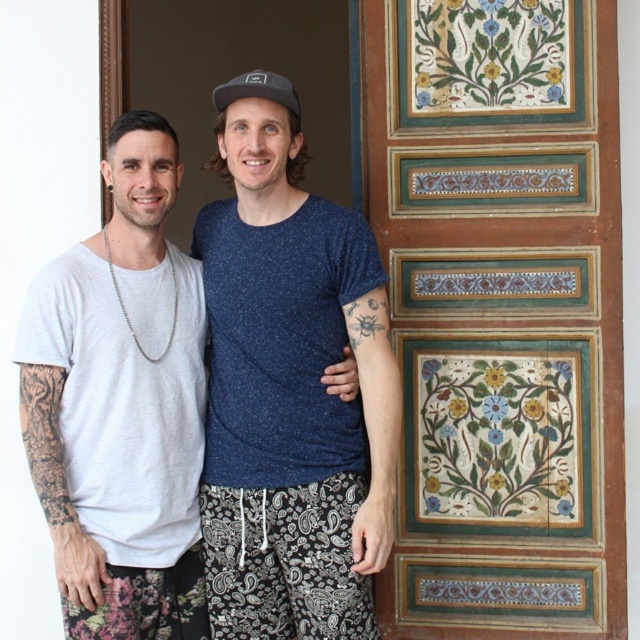
Question: Does wooden panel with painted floral design at right appear under white cotton t-shirt at center?

Choices:
 (A) yes
 (B) no

Answer: (B)

Question: Estimate the real-world distances between objects in this image. Which object is closer to the wooden panel with painted floral design at right?

Choices:
 (A) white cotton t-shirt at center
 (B) white cotton t-shirt at left

Answer: (A)

Question: In this image, where is white cotton t-shirt at center located relative to white cotton t-shirt at left?

Choices:
 (A) above
 (B) below

Answer: (A)

Question: Which point is farther from the camera taking this photo?

Choices:
 (A) (484, 118)
 (B) (102, 355)
 (C) (276, 115)

Answer: (A)

Question: Is wooden panel with painted floral design at right further to the viewer compared to white cotton t-shirt at left?

Choices:
 (A) yes
 (B) no

Answer: (A)

Question: Which object is closer to the camera taking this photo?

Choices:
 (A) white cotton t-shirt at left
 (B) white cotton t-shirt at center

Answer: (A)